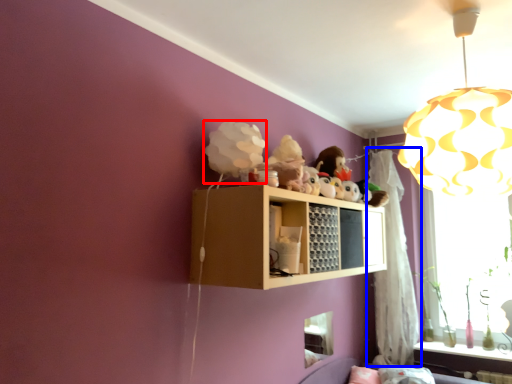
Question: Which object appears closest to the camera in this image, toy (highlighted by a red box) or curtain (highlighted by a blue box)?

Choices:
 (A) toy
 (B) curtain

Answer: (A)